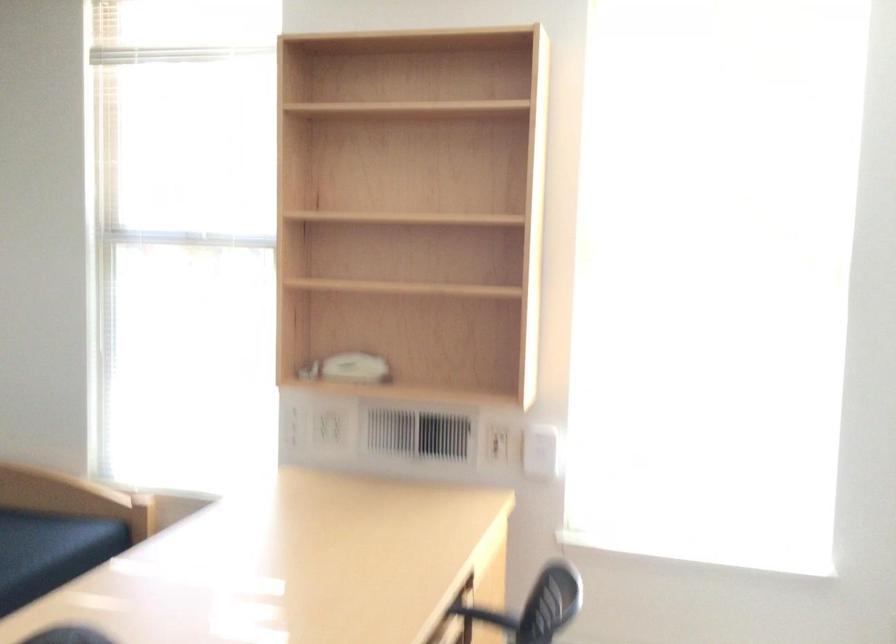
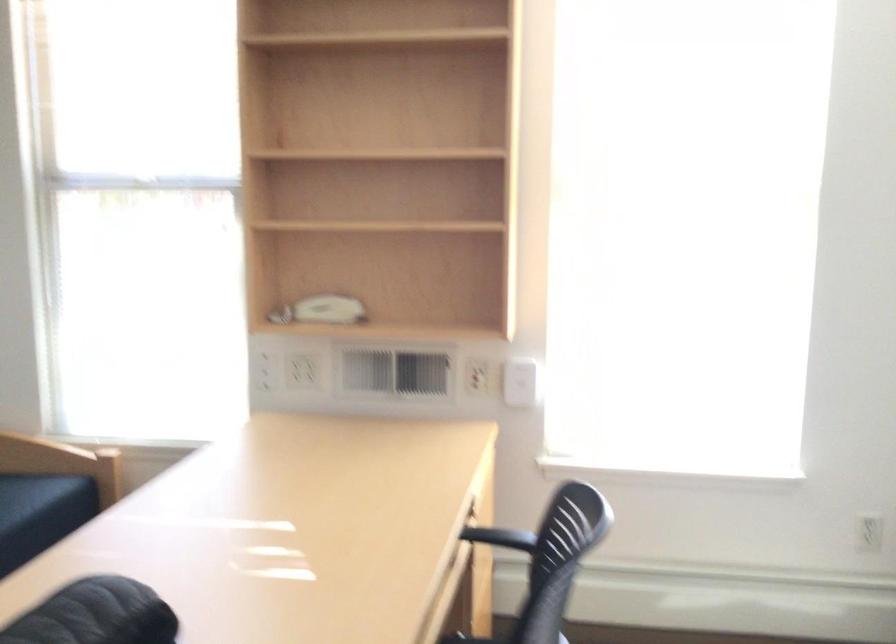
Question: The camera is either moving clockwise (left) or counter-clockwise (right) around the object. The first image is from the beginning of the video and the second image is from the end. Is the camera moving left or right when shooting the video?

Choices:
 (A) Left
 (B) Right

Answer: (A)